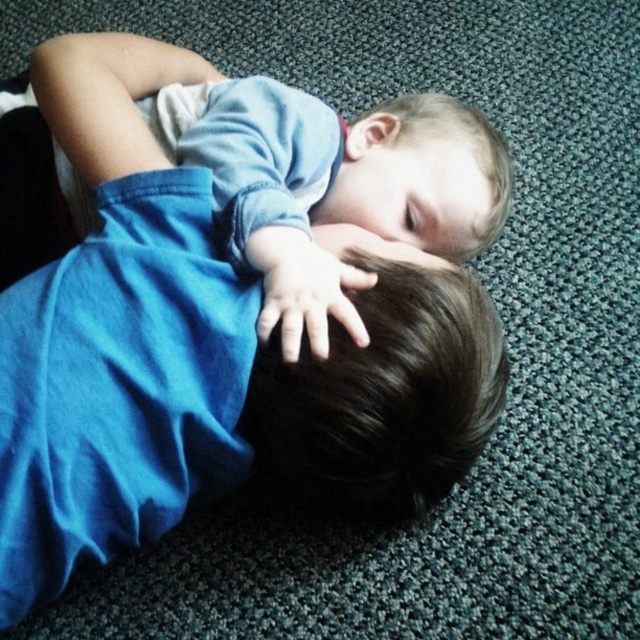
The height and width of the screenshot is (640, 640). Describe the element at coordinates (288, 168) in the screenshot. I see `blue denim shirt at upper center` at that location.

Is the position of blue denim shirt at upper center more distant than that of dark brown hair at center?

No.

What do you see at coordinates (288, 168) in the screenshot?
I see `blue denim shirt at upper center` at bounding box center [288, 168].

Image resolution: width=640 pixels, height=640 pixels. What are the coordinates of `blue denim shirt at upper center` in the screenshot? It's located at (288, 168).